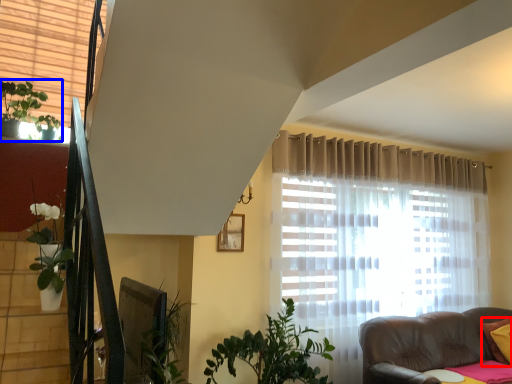
Question: Which point is closer to the camera, pillow (highlighted by a red box) or houseplant (highlighted by a blue box)?

Choices:
 (A) pillow
 (B) houseplant

Answer: (B)